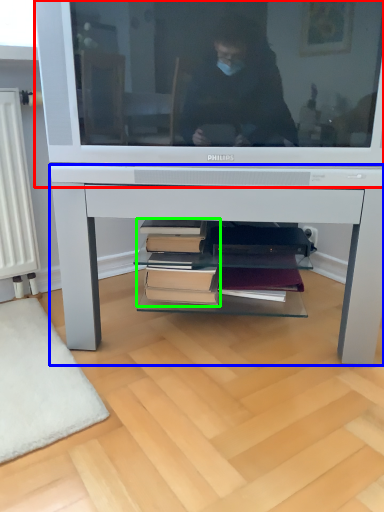
Question: Based on their relative distances, which object is farther from television (highlighted by a red box)? Choose from desk (highlighted by a blue box) and book (highlighted by a green box).

Choices:
 (A) desk
 (B) book

Answer: (B)